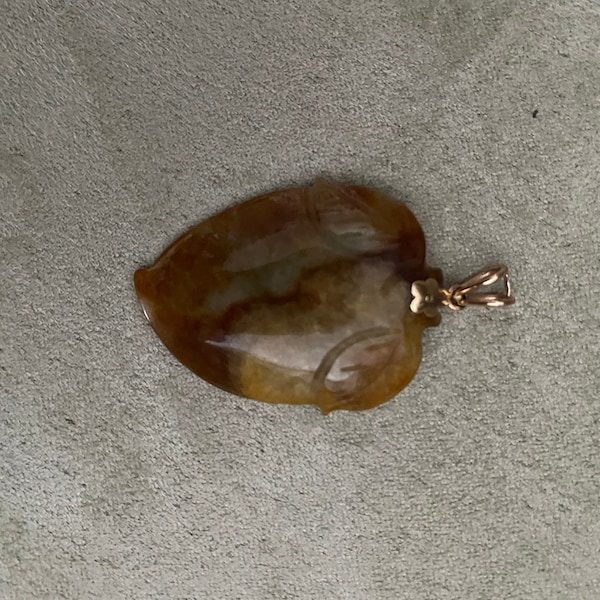
The image size is (600, 600). In order to click on hook in this screenshot , I will do `click(486, 296)`.